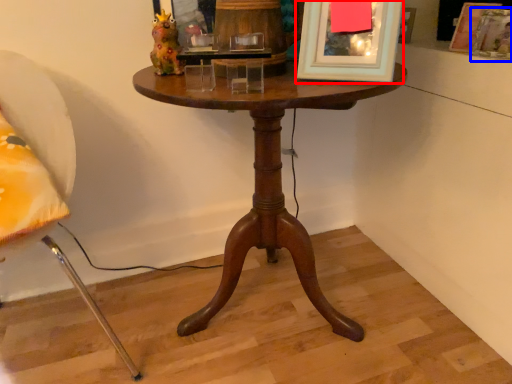
Question: Which of the following is the closest to the observer, picture frame (highlighted by a red box) or picture frame (highlighted by a blue box)?

Choices:
 (A) picture frame
 (B) picture frame

Answer: (A)